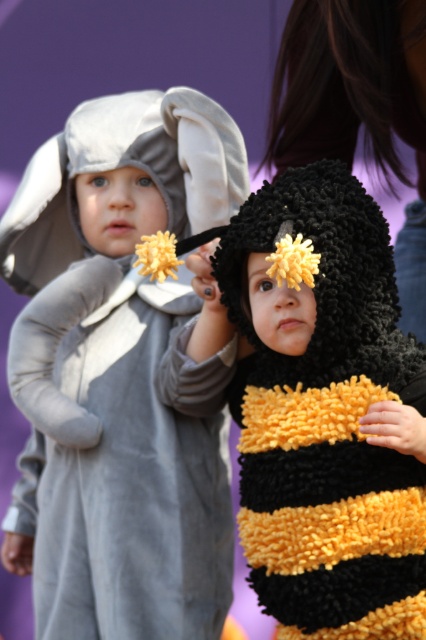
Question: Among these objects, which one is farthest from the camera?

Choices:
 (A) black fuzzy hat at upper center
 (B) fuzzy yellow-black bee at center

Answer: (A)

Question: Which of these objects is positioned farthest from the fuzzy yellow-black bee at center?

Choices:
 (A) velvety gray elephant at left
 (B) black fuzzy hat at upper center

Answer: (B)

Question: Which of these objects is positioned closest to the velvety gray elephant at left?

Choices:
 (A) fuzzy yellow-black bee at center
 (B) black fuzzy hat at upper center

Answer: (A)

Question: Can you confirm if velvety gray elephant at left is bigger than black fuzzy hat at upper center?

Choices:
 (A) no
 (B) yes

Answer: (B)

Question: Does velvety gray elephant at left appear over fuzzy yellow-black bee at center?

Choices:
 (A) yes
 (B) no

Answer: (A)

Question: Can you confirm if velvety gray elephant at left is positioned to the left of black fuzzy hat at upper center?

Choices:
 (A) yes
 (B) no

Answer: (A)